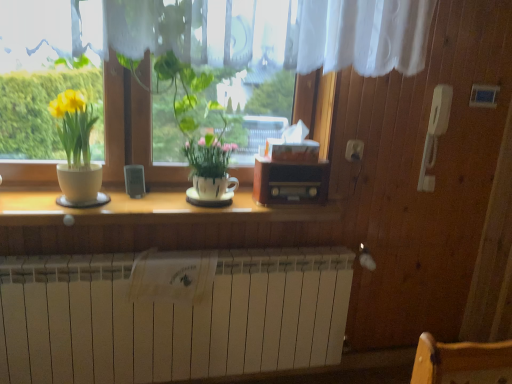
Question: Is white matte radiator at lower center taller than matte white pot at left, the 1th houseplant when ordered from left to right?

Choices:
 (A) no
 (B) yes

Answer: (B)

Question: Does white matte radiator at lower center have a smaller size compared to matte white pot at left, the 1th houseplant when ordered from left to right?

Choices:
 (A) yes
 (B) no

Answer: (B)

Question: Could you tell me if white matte radiator at lower center is facing matte white pot at left, the 2th houseplant viewed from the right?

Choices:
 (A) yes
 (B) no

Answer: (B)

Question: Is white matte radiator at lower center at the right side of matte white pot at left, the 1th houseplant when ordered from left to right?

Choices:
 (A) yes
 (B) no

Answer: (A)

Question: Considering the relative positions of white matte radiator at lower center and matte white pot at left, the 2th houseplant viewed from the right, in the image provided, is white matte radiator at lower center in front of matte white pot at left, the 2th houseplant viewed from the right,?

Choices:
 (A) no
 (B) yes

Answer: (A)

Question: Can you confirm if white matte radiator at lower center is positioned to the left of matte white pot at left, the 2th houseplant viewed from the right?

Choices:
 (A) yes
 (B) no

Answer: (B)

Question: Is the depth of wooden radio at center greater than that of white matte radiator at lower center?

Choices:
 (A) no
 (B) yes

Answer: (B)

Question: Are wooden radio at center and white matte radiator at lower center located far from each other?

Choices:
 (A) yes
 (B) no

Answer: (B)

Question: Does wooden radio at center have a greater height compared to white matte radiator at lower center?

Choices:
 (A) no
 (B) yes

Answer: (A)

Question: Is wooden radio at center shorter than white matte radiator at lower center?

Choices:
 (A) yes
 (B) no

Answer: (A)

Question: Is wooden radio at center facing towards white matte radiator at lower center?

Choices:
 (A) yes
 (B) no

Answer: (B)

Question: Is wooden radio at center at the left side of white matte radiator at lower center?

Choices:
 (A) no
 (B) yes

Answer: (A)

Question: Does white matte radiator at lower center have a lesser width compared to wooden radio at center?

Choices:
 (A) no
 (B) yes

Answer: (A)